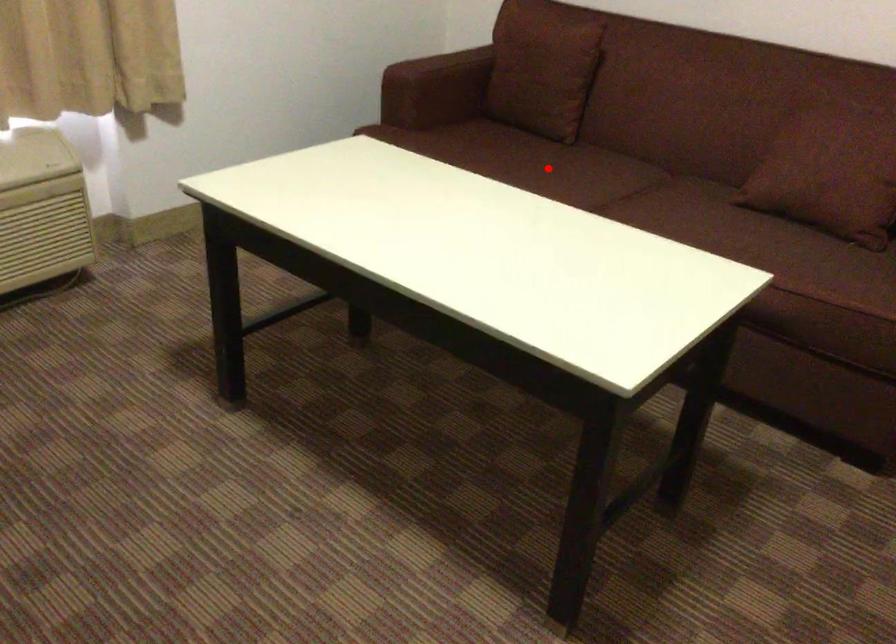
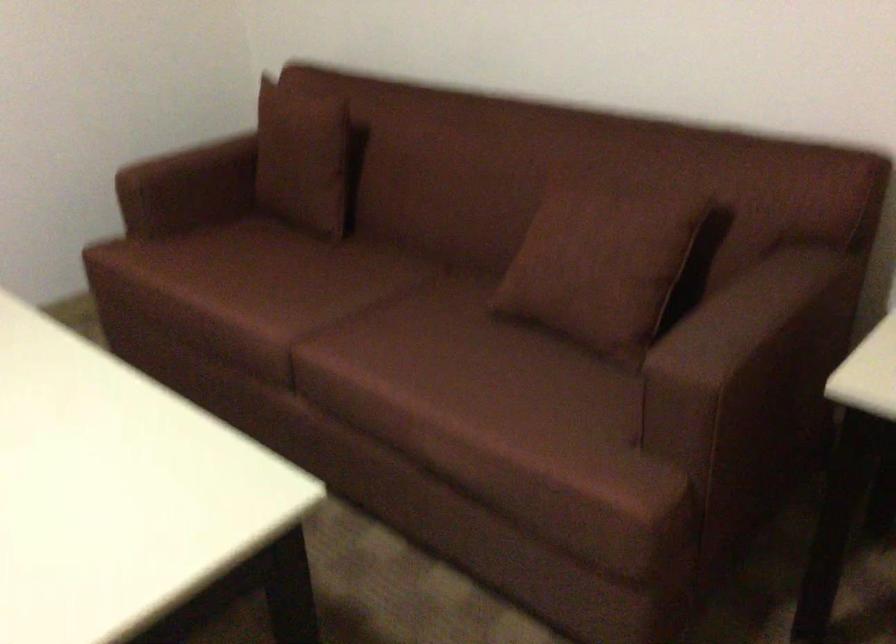
In the second image, find the point that corresponds to the highlighted location in the first image.

(286, 283)